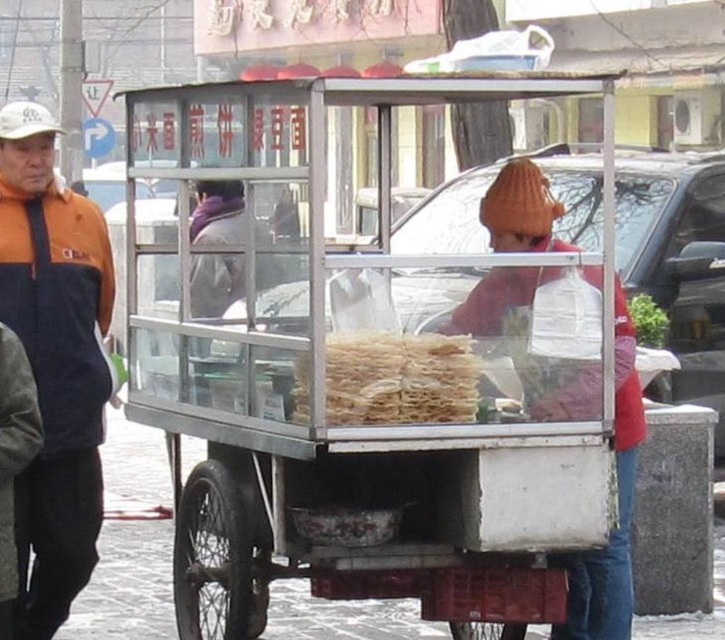
Who is lower down, orange knit hat at center or translucent plastic noodles at center?

orange knit hat at center is lower down.

Does orange knit hat at center have a greater width compared to translucent plastic noodles at center?

Correct, the width of orange knit hat at center exceeds that of translucent plastic noodles at center.

At what (x,y) coordinates should I click in order to perform the action: click on orange knit hat at center. Please return your answer as a coordinate pair (x, y). This screenshot has height=640, width=725. Looking at the image, I should click on (618, 508).

Does metallic silver cart at center have a lesser width compared to translucent plastic noodles at center?

In fact, metallic silver cart at center might be wider than translucent plastic noodles at center.

From the picture: Is metallic silver cart at center taller than translucent plastic noodles at center?

Correct, metallic silver cart at center is much taller as translucent plastic noodles at center.

Does point (297, 305) come behind point (298, 406)?

Yes, it is.

You are a GUI agent. You are given a task and a screenshot of the screen. Output one action in this format:
    pyautogui.click(x=<x>, y=<y>)
    Task: Click on the metallic silver cart at center
    Image resolution: width=725 pixels, height=640 pixels.
    Given the screenshot: What is the action you would take?
    pyautogui.click(x=384, y=381)

Can you confirm if orange fleece jacket at left is thinner than orange knit hat at center?

Yes, orange fleece jacket at left is thinner than orange knit hat at center.

Who is more forward, (16, 493) or (480, 212)?

Point (16, 493) is more forward.

I want to click on orange fleece jacket at left, so click(54, 362).